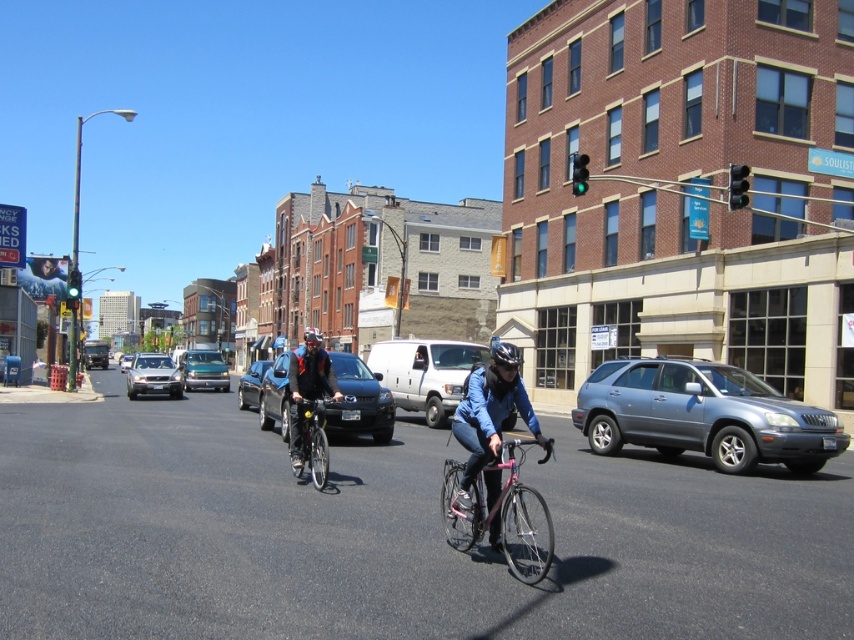
Question: Which point appears farthest from the camera in this image?

Choices:
 (A) (127, 356)
 (B) (268, 451)
 (C) (291, 424)
 (D) (100, 364)

Answer: (A)

Question: Which of the following is the farthest from the observer?

Choices:
 (A) (319, 369)
 (B) (489, 522)

Answer: (A)

Question: Which of these objects is positioned closest to the metallic bicycle at center?

Choices:
 (A) pink metallic bicycle at center
 (B) matte black helmet at center
 (C) matte silver suv at center
 (D) silver metallic suv at center-left

Answer: (B)

Question: Is metallic bicycle at center further to camera compared to matte black car at center?

Choices:
 (A) yes
 (B) no

Answer: (B)

Question: Is metallic blue suv at right to the right of matte silver suv at center from the viewer's perspective?

Choices:
 (A) yes
 (B) no

Answer: (A)

Question: Can you confirm if pink metallic bicycle at center is positioned to the right of silver metallic sedan at center?

Choices:
 (A) yes
 (B) no

Answer: (A)